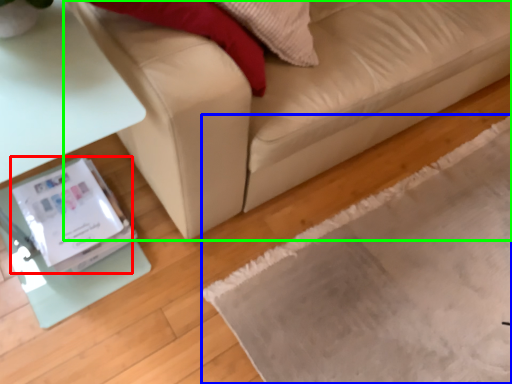
Question: Which object is the closest to the Wii (highlighted by a red box)? Choose among these: mat (highlighted by a blue box) or studio couch (highlighted by a green box).

Choices:
 (A) mat
 (B) studio couch

Answer: (B)